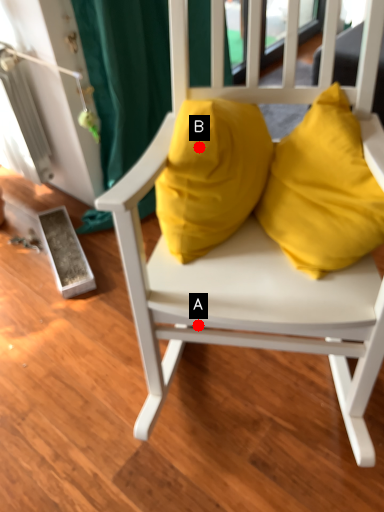
Question: Two points are circled on the image, labeled by A and B beside each circle. Which point appears farthest from the camera in this image?

Choices:
 (A) A is further
 (B) B is further

Answer: (A)